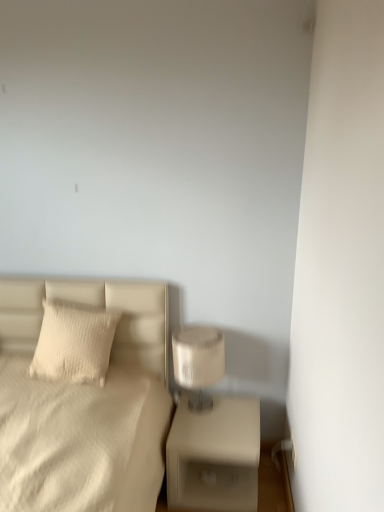
Question: From the image's perspective, is white textured pillow at left located beneath beige matte nightstand at lower right?

Choices:
 (A) no
 (B) yes

Answer: (A)

Question: From a real-world perspective, is white textured pillow at left positioned under beige matte nightstand at lower right based on gravity?

Choices:
 (A) yes
 (B) no

Answer: (B)

Question: Is beige matte nightstand at lower right completely or partially inside white textured pillow at left?

Choices:
 (A) yes
 (B) no

Answer: (B)

Question: Is white textured pillow at left further to camera compared to beige matte nightstand at lower right?

Choices:
 (A) no
 (B) yes

Answer: (B)

Question: Can you see white textured pillow at left touching beige matte nightstand at lower right?

Choices:
 (A) no
 (B) yes

Answer: (A)

Question: Is white textured pillow at left to the left of beige matte nightstand at lower right from the viewer's perspective?

Choices:
 (A) yes
 (B) no

Answer: (A)

Question: From a real-world perspective, is white textured bed at left located higher than white textured pillow at left?

Choices:
 (A) no
 (B) yes

Answer: (A)

Question: Is white textured bed at left outside of white textured pillow at left?

Choices:
 (A) yes
 (B) no

Answer: (A)

Question: Considering the relative sizes of white textured bed at left and white textured pillow at left in the image provided, is white textured bed at left bigger than white textured pillow at left?

Choices:
 (A) no
 (B) yes

Answer: (B)

Question: Are white textured bed at left and white textured pillow at left far apart?

Choices:
 (A) yes
 (B) no

Answer: (B)

Question: Is white textured bed at left taller than white textured pillow at left?

Choices:
 (A) yes
 (B) no

Answer: (A)

Question: From a real-world perspective, is white textured bed at left under white textured pillow at left?

Choices:
 (A) yes
 (B) no

Answer: (A)

Question: From the image's perspective, does beige matte nightstand at lower right appear higher than white textured pillow at left?

Choices:
 (A) no
 (B) yes

Answer: (A)